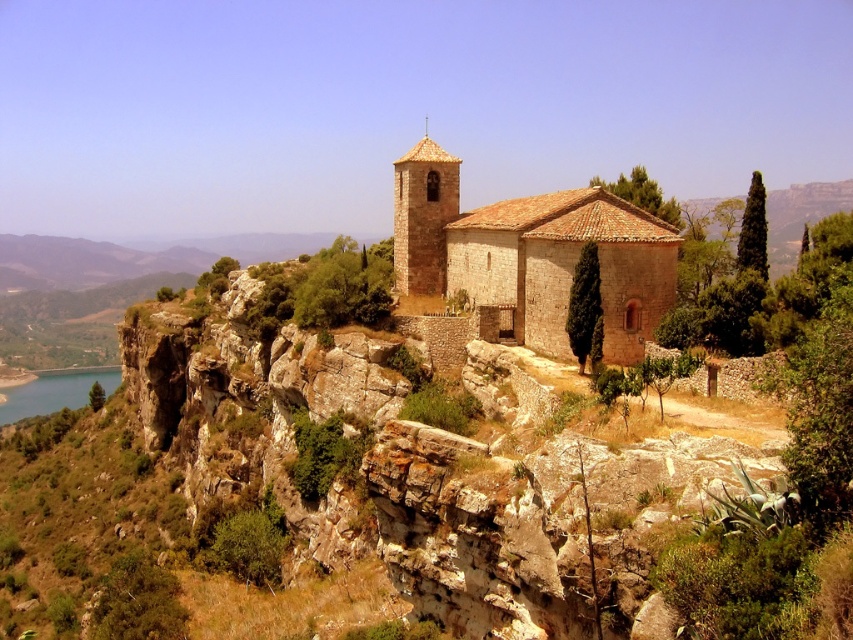
You are a drone operator tasked with capturing aerial footage of the brown stone church at center. Your drone has a maximum flight range of 60 meters. Can you safely fly the drone from your current position to the church and back without exceeding the range limit?

The distance between the brown stone church at center and the camera is 57.40 meters. Since the drone can fly up to 60 meters, the round trip distance would be 114.80 meters. However, the maximum flight range refers to one way distance. Therefore, the drone can safely reach the church as 57.40 meters is within the 60 meters limit.

You are a photographer planning to capture the brown stone church at center and the blue smooth water at lower left in a single wide shot. Based on their sizes in the image, which one will appear smaller in the final photo?

The brown stone church at center appears smaller in the final photo because it has a smaller size compared to the blue smooth water at lower left.

You are a hiker who has just reached the top of the cliff. You see the brown stone church at center and the blue smooth water at lower left. Which direction should you go to get closer to the water?

The brown stone church at center is positioned over the blue smooth water at lower left, so to get closer to the water, you should go downward from the church towards the lower left direction.